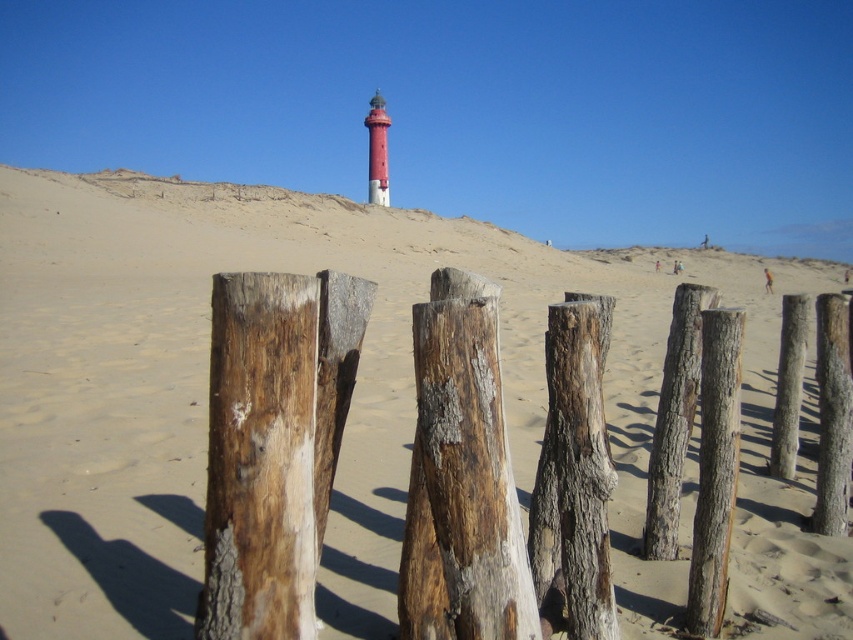
Which is below, weathered wood post at center or weathered wood post at center-right?

weathered wood post at center

Between point (734, 310) and point (824, 448), which one is positioned in front?

Positioned in front is point (734, 310).

This screenshot has height=640, width=853. What are the coordinates of `weathered wood post at center` in the screenshot? It's located at (715, 468).

Between weathered wood post at center and smooth wood post at upper center, which one has more height?

smooth wood post at upper center is taller.

Is weathered wood post at center in front of smooth wood post at upper center?

Yes, weathered wood post at center is closer to the viewer.

Which is in front, point (717, 522) or point (364, 116)?

Point (717, 522)

This screenshot has width=853, height=640. What are the coordinates of `weathered wood post at center` in the screenshot? It's located at (715, 468).

Does weathered wood post at center-right have a lesser height compared to smooth wood post at upper center?

Yes, weathered wood post at center-right is shorter than smooth wood post at upper center.

Which is behind, point (839, 355) or point (381, 182)?

Positioned behind is point (381, 182).

Which is behind, point (827, 305) or point (379, 152)?

The point (379, 152) is behind.

Where is `weathered wood post at center-right`? weathered wood post at center-right is located at coordinates (833, 416).